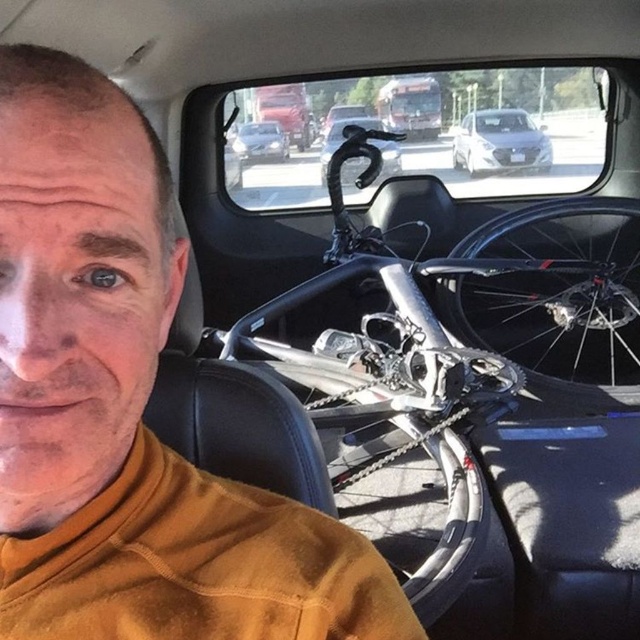
You are sitting in the driver seat and see the matte gold shirt at left and the brushed metal bus at upper center in your view. Which object appears taller in your current view?

The matte gold shirt at left is taller than the brushed metal bus at upper center in the driver seat view.

You are a passenger in the car and looking out the window. You see a white glossy sedan at upper center and a brushed metal bus at upper center. Which one is closer to the car?

The white glossy sedan at upper center is closer to the car because it is located below the brushed metal bus at upper center, meaning it is positioned in front of the bus from the observer perspective.